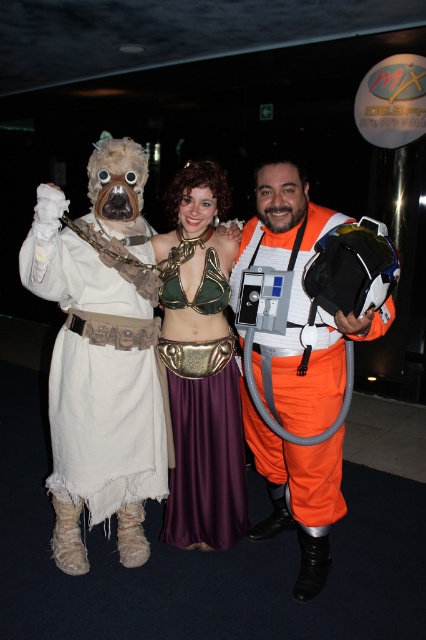
Between point (307, 509) and point (167, 342), which one is positioned in front?

Point (307, 509) is more forward.

Which is more to the left, orange fabric spacesuit at center or velvet purple skirt at center?

velvet purple skirt at center

What are the coordinates of `orange fabric spacesuit at center` in the screenshot? It's located at (298, 305).

Locate an element on the screen. This screenshot has width=426, height=640. orange fabric spacesuit at center is located at coordinates click(x=298, y=305).

Between fuzzy white costume at left and velvet purple dress at center, which one appears on the left side from the viewer's perspective?

fuzzy white costume at left is more to the left.

The width and height of the screenshot is (426, 640). Identify the location of fuzzy white costume at left. (98, 387).

Where is `fuzzy white costume at left`? fuzzy white costume at left is located at coordinates (98, 387).

Is shiny metallic armor at center shorter than velvet purple skirt at center?

In fact, shiny metallic armor at center may be taller than velvet purple skirt at center.

Who is more distant from viewer, (x=129, y=180) or (x=224, y=422)?

The point (x=224, y=422) is more distant.

Is point (175, 208) closer to camera compared to point (221, 412)?

Yes, point (175, 208) is closer to viewer.

Where is `shiny metallic armor at center`? shiny metallic armor at center is located at coordinates (199, 257).